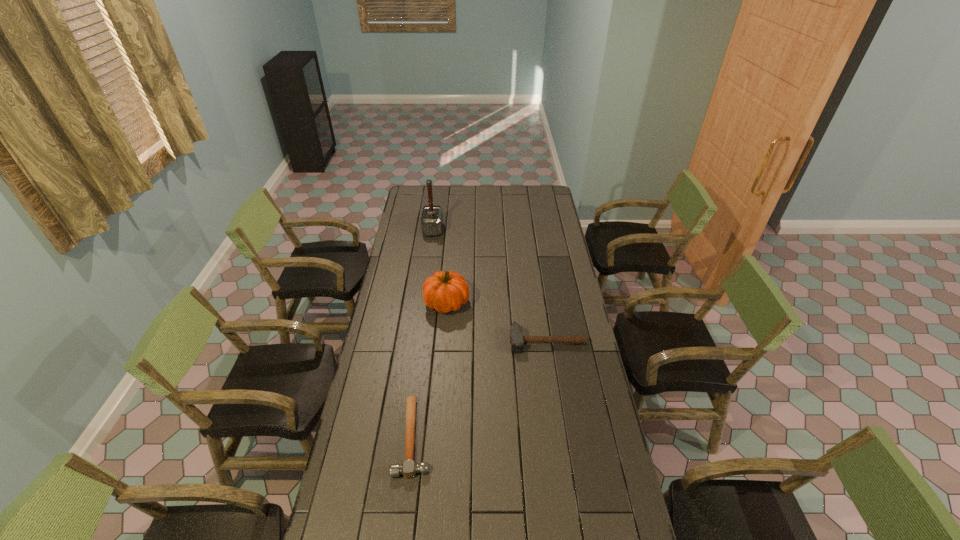
At what (x,y) coordinates should I click in order to perform the action: click on free point located 0.200m on the striking surface of the second shortest object. Please return your answer as a coordinate pair (x, y). The image size is (960, 540). Looking at the image, I should click on (555, 395).

Where is `vacant space located 0.170m on the left of the nearest object`? The width and height of the screenshot is (960, 540). vacant space located 0.170m on the left of the nearest object is located at coordinates (348, 436).

Identify the location of object situated at the left edge. This screenshot has width=960, height=540. (432, 217).

What are the coordinates of `object that is at the right edge` in the screenshot? It's located at (517, 340).

Where is `vacant space at the far edge`? Image resolution: width=960 pixels, height=540 pixels. vacant space at the far edge is located at coordinates (434, 190).

In the image, there is a desktop. Identify the location of vacant space at the left edge. The width and height of the screenshot is (960, 540). (403, 228).

Locate an element on the screen. Image resolution: width=960 pixels, height=540 pixels. vacant space at the right edge of the desktop is located at coordinates pyautogui.click(x=549, y=329).

This screenshot has width=960, height=540. Identify the location of vacant space that's between the third nearest object and the rightmost hammer. (497, 322).

The height and width of the screenshot is (540, 960). I want to click on free space between the farthest hammer and the third nearest object, so click(x=440, y=266).

Locate an element on the screen. vacant space that is in between the third shortest object and the farthest object is located at coordinates (440, 266).